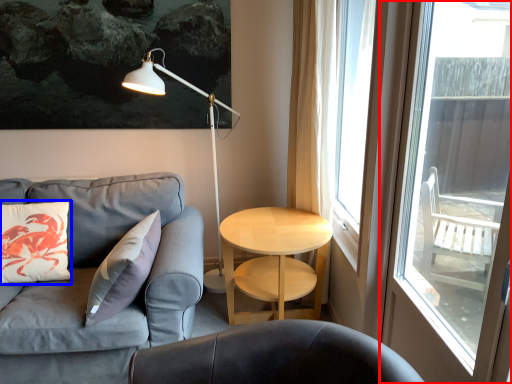
Question: Which of the following is the closest to the observer, window (highlighted by a red box) or pillow (highlighted by a blue box)?

Choices:
 (A) window
 (B) pillow

Answer: (A)